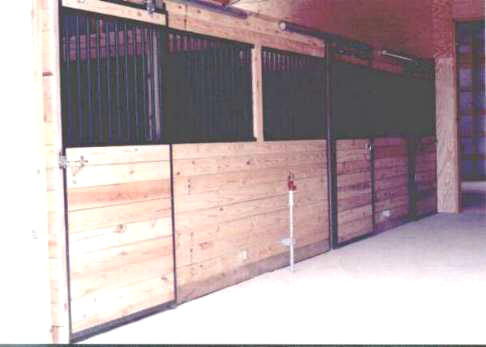
What are the coordinates of `floor` in the screenshot? It's located at (340, 294).